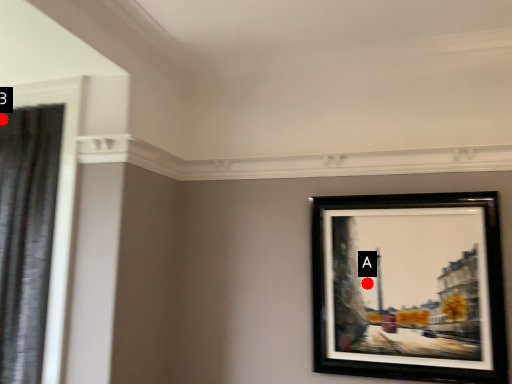
Question: Two points are circled on the image, labeled by A and B beside each circle. Which point is closer to the camera taking this photo?

Choices:
 (A) A is closer
 (B) B is closer

Answer: (A)